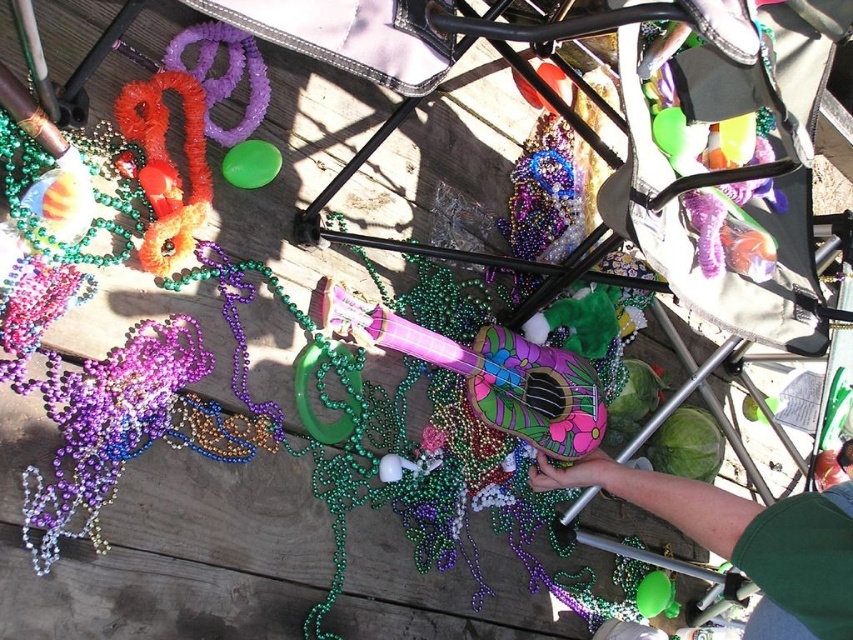
Between green fabric hand at lower right and painted wood ukulele at center, which one has more height?

With more height is painted wood ukulele at center.

Consider the image. Is green fabric hand at lower right wider than painted wood ukulele at center?

Incorrect, green fabric hand at lower right's width does not surpass painted wood ukulele at center's.

Between point (808, 538) and point (341, 333), which one is positioned in front?

Point (808, 538) is more forward.

Where is `green fabric hand at lower right`? This screenshot has height=640, width=853. green fabric hand at lower right is located at coordinates (746, 540).

Who is shorter, painted wood ukulele at center or orange fuzzy pipe at upper left?

With less height is orange fuzzy pipe at upper left.

Which is behind, point (397, 346) or point (160, 81)?

The point (397, 346) is behind.

Does point (438, 342) come farther from viewer compared to point (132, 113)?

Yes, point (438, 342) is farther from viewer.

The height and width of the screenshot is (640, 853). I want to click on painted wood ukulele at center, so click(x=490, y=372).

Which is more to the right, green fabric hand at lower right or orange fuzzy pipe at upper left?

Positioned to the right is green fabric hand at lower right.

Is point (766, 612) less distant than point (131, 84)?

Yes, point (766, 612) is in front of point (131, 84).

Who is more distant from viewer, (538, 468) or (189, 204)?

Point (538, 468)

Where is `green fabric hand at lower right`? green fabric hand at lower right is located at coordinates (746, 540).